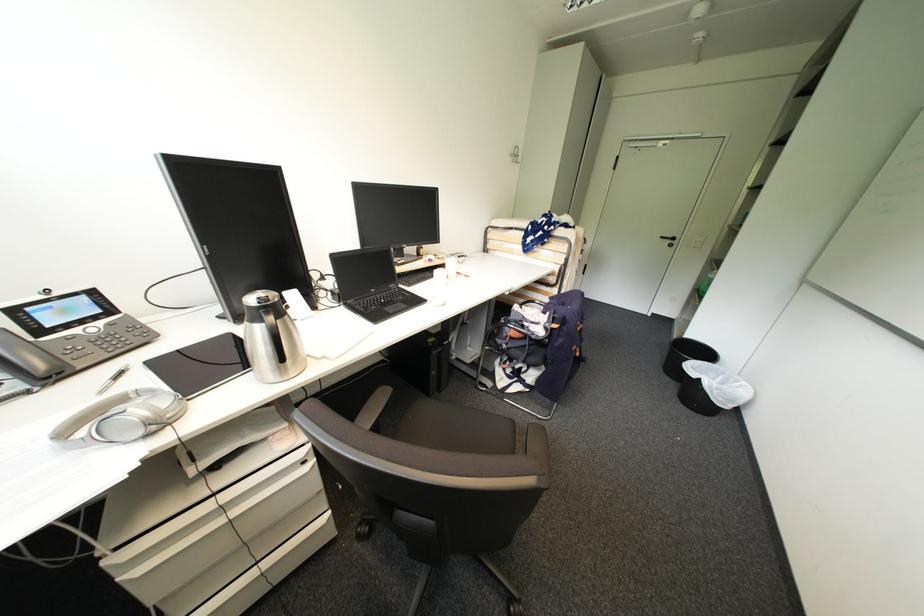
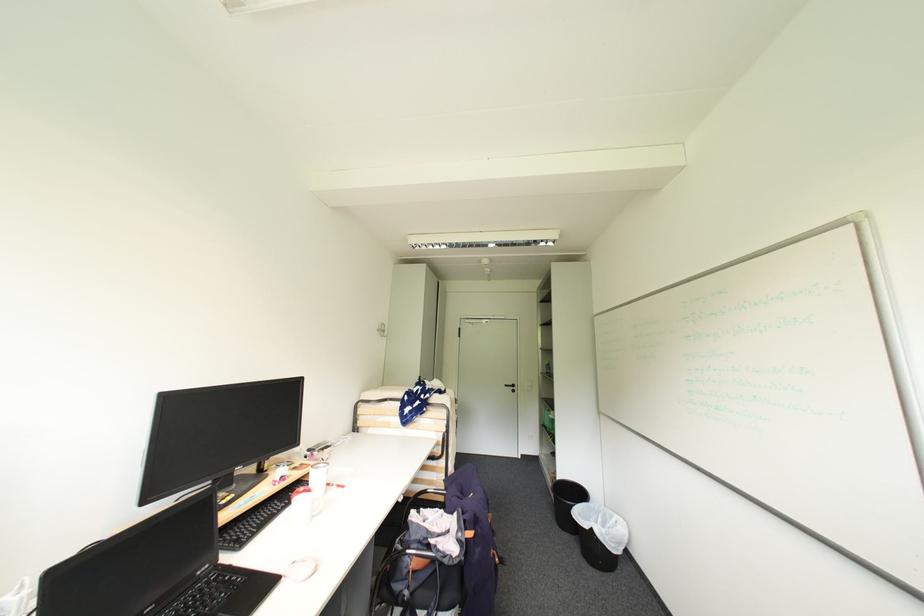
Locate, in the second image, the point that corresponds to (x=513, y=294) in the first image.

(407, 501)